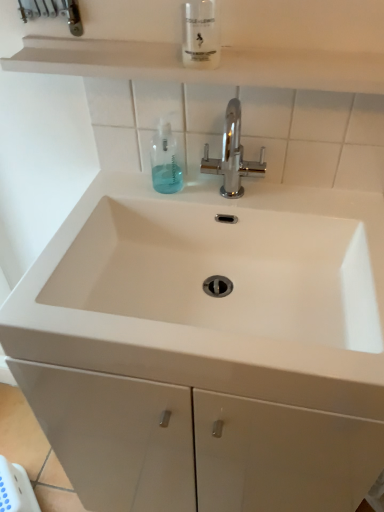
This screenshot has height=512, width=384. Find the location of `vacant region to the left of chrome metallic faucet at center`. vacant region to the left of chrome metallic faucet at center is located at coordinates (151, 188).